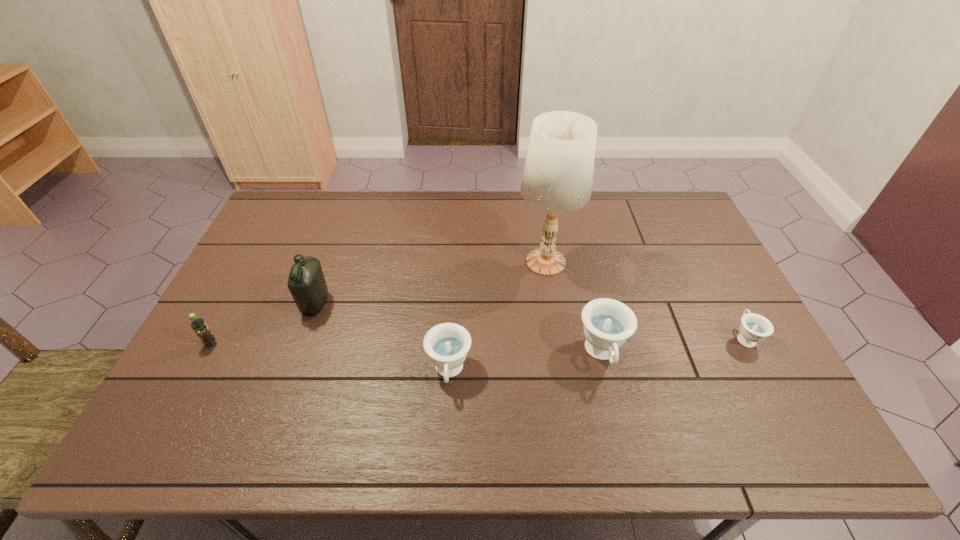
Image resolution: width=960 pixels, height=540 pixels. Find the location of `blank space at the right edge of the desktop`. blank space at the right edge of the desktop is located at coordinates 684,303.

This screenshot has height=540, width=960. In the image, there is a desktop. In order to click on vacant space at the far left corner in this screenshot , I will do `click(292, 230)`.

Identify the location of vacant area at the far right corner. This screenshot has width=960, height=540. (684, 227).

The height and width of the screenshot is (540, 960). What are the coordinates of `free space between the second teacup from right to left and the leftmost teacup` in the screenshot? It's located at (525, 363).

Where is `vacant point located between the soda and the fourth object from right to left`? The height and width of the screenshot is (540, 960). vacant point located between the soda and the fourth object from right to left is located at coordinates (330, 358).

Where is `vacant area between the second teacup from right to left and the leftmost teacup`? Image resolution: width=960 pixels, height=540 pixels. vacant area between the second teacup from right to left and the leftmost teacup is located at coordinates (525, 363).

At what (x,y) coordinates should I click in order to perform the action: click on free space between the third object from left to right and the soda. Please return your answer as a coordinate pair (x, y). This screenshot has height=540, width=960. Looking at the image, I should click on [x=330, y=358].

Locate an element on the screen. The height and width of the screenshot is (540, 960). vacant point located between the soda and the third object from left to right is located at coordinates (330, 358).

The height and width of the screenshot is (540, 960). In order to click on vacant area that lies between the lamp and the soda in this screenshot , I will do `click(378, 303)`.

Identify the location of free space between the lamp and the second tallest teacup. (497, 317).